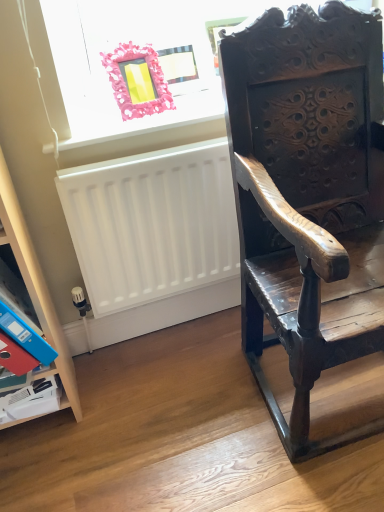
Find the location of a particular element. free space in front of wooden shelf at lower left is located at coordinates (52, 466).